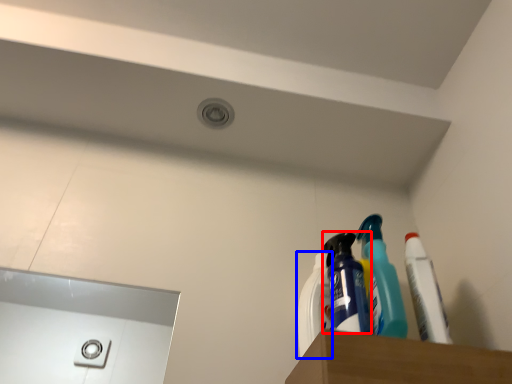
Question: Among these objects, which one is nearest to the camera, cleaning product (highlighted by a red box) or cleaning product (highlighted by a blue box)?

Choices:
 (A) cleaning product
 (B) cleaning product

Answer: (A)